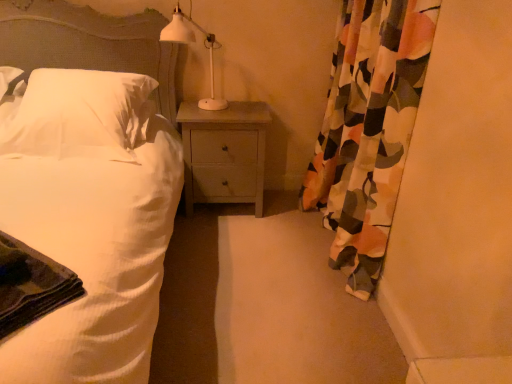
Question: Is white matte table lamp at upper center aimed at white soft pillow at left?

Choices:
 (A) no
 (B) yes

Answer: (A)

Question: Can you confirm if white matte table lamp at upper center is wider than white soft pillow at left?

Choices:
 (A) yes
 (B) no

Answer: (B)

Question: From the image's perspective, does white matte table lamp at upper center appear lower than white soft pillow at left?

Choices:
 (A) no
 (B) yes

Answer: (A)

Question: Is white matte table lamp at upper center not within white soft pillow at left?

Choices:
 (A) yes
 (B) no

Answer: (A)

Question: Can you confirm if white matte table lamp at upper center is positioned to the left of white soft pillow at left?

Choices:
 (A) no
 (B) yes

Answer: (A)

Question: From the image's perspective, is white matte table lamp at upper center above or below floral fabric curtain at right?

Choices:
 (A) below
 (B) above

Answer: (B)

Question: Looking at their shapes, would you say white matte table lamp at upper center is wider or thinner than floral fabric curtain at right?

Choices:
 (A) wide
 (B) thin

Answer: (A)

Question: Is white matte table lamp at upper center inside the boundaries of floral fabric curtain at right, or outside?

Choices:
 (A) inside
 (B) outside

Answer: (B)

Question: Visually, is white matte table lamp at upper center positioned to the left or to the right of floral fabric curtain at right?

Choices:
 (A) right
 (B) left

Answer: (B)

Question: Considering the positions of white textured bed at left and dark green fabric at lower left in the image, is white textured bed at left wider or thinner than dark green fabric at lower left?

Choices:
 (A) wide
 (B) thin

Answer: (A)

Question: Based on their sizes in the image, would you say white textured bed at left is bigger or smaller than dark green fabric at lower left?

Choices:
 (A) big
 (B) small

Answer: (A)

Question: Does point (87, 76) appear closer or farther from the camera than point (6, 314)?

Choices:
 (A) farther
 (B) closer

Answer: (A)

Question: Is white textured bed at left taller or shorter than dark green fabric at lower left?

Choices:
 (A) short
 (B) tall

Answer: (B)

Question: Based on their sizes in the image, would you say dark green fabric at lower left is bigger or smaller than light wood nightstand at center?

Choices:
 (A) small
 (B) big

Answer: (A)

Question: Is dark green fabric at lower left wider or thinner than light wood nightstand at center?

Choices:
 (A) thin
 (B) wide

Answer: (A)